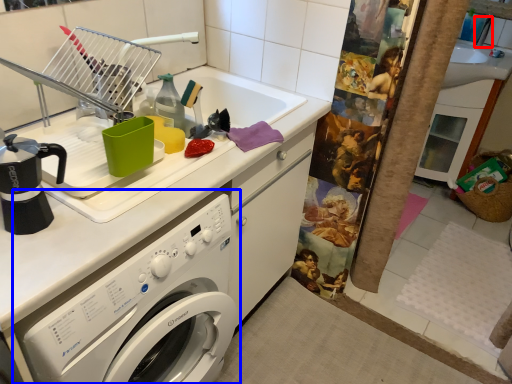
Question: Which point is further to the camera, faucet (highlighted by a red box) or washing machine (highlighted by a blue box)?

Choices:
 (A) faucet
 (B) washing machine

Answer: (A)